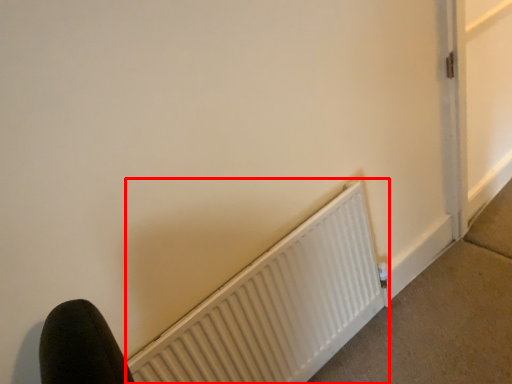
Question: Observing the image, what is the correct spatial positioning of radiator (annotated by the red box) in reference to concrete?

Choices:
 (A) left
 (B) right

Answer: (A)